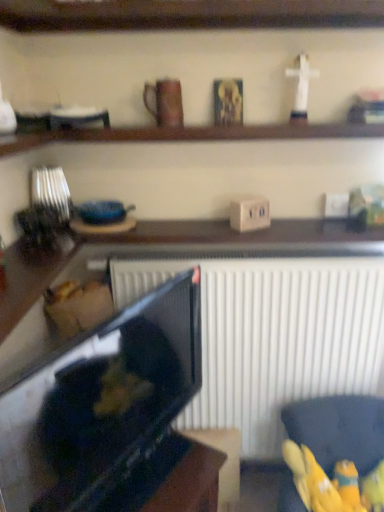
Question: Is wooden figurine at upper right, the 2th toy in the right-to-left sequence, inside brown matte mug at upper center?

Choices:
 (A) no
 (B) yes

Answer: (A)

Question: Would you say brown matte mug at upper center is a long distance from wooden figurine at upper right, the 2th toy in the right-to-left sequence?

Choices:
 (A) yes
 (B) no

Answer: (B)

Question: From a real-world perspective, is brown matte mug at upper center below wooden figurine at upper right, the 3th toy in the bottom-to-top sequence?

Choices:
 (A) yes
 (B) no

Answer: (B)

Question: From a real-world perspective, is brown matte mug at upper center positioned over wooden figurine at upper right, the 3th toy in the bottom-to-top sequence, based on gravity?

Choices:
 (A) yes
 (B) no

Answer: (A)

Question: Can we say brown matte mug at upper center lies outside wooden figurine at upper right, the second toy positioned from the top?

Choices:
 (A) yes
 (B) no

Answer: (A)

Question: In terms of size, does brown matte mug at upper center appear bigger or smaller than wooden shelf at upper center, marked as the 1th shelf in a bottom-to-top arrangement?

Choices:
 (A) small
 (B) big

Answer: (A)

Question: Is brown matte mug at upper center taller or shorter than wooden shelf at upper center, the 2th shelf when ordered from top to bottom?

Choices:
 (A) short
 (B) tall

Answer: (B)

Question: Is brown matte mug at upper center in front of or behind wooden shelf at upper center, marked as the 1th shelf in a bottom-to-top arrangement, in the image?

Choices:
 (A) behind
 (B) front

Answer: (A)

Question: From the image's perspective, is brown matte mug at upper center located above or below wooden shelf at upper center, marked as the 1th shelf in a bottom-to-top arrangement?

Choices:
 (A) below
 (B) above

Answer: (B)

Question: Considering the positions of point (148, 109) and point (365, 509), is point (148, 109) closer or farther from the camera than point (365, 509)?

Choices:
 (A) farther
 (B) closer

Answer: (B)

Question: Would you say brown matte mug at upper center is to the left or to the right of yellow fabric toy at lower right, the third toy viewed from the right, in the picture?

Choices:
 (A) left
 (B) right

Answer: (A)

Question: Considering the positions of brown matte mug at upper center and yellow fabric toy at lower right, the 1th toy in the bottom-to-top sequence, in the image, is brown matte mug at upper center taller or shorter than yellow fabric toy at lower right, the 1th toy in the bottom-to-top sequence,?

Choices:
 (A) tall
 (B) short

Answer: (A)

Question: Choose the correct answer: Is brown matte mug at upper center inside yellow fabric toy at lower right, the second toy in the left-to-right sequence, or outside it?

Choices:
 (A) inside
 (B) outside

Answer: (B)

Question: Considering the positions of wooden shelf at upper center, the 2th shelf when ordered from top to bottom, and white plastic cross at upper right, the first toy in the top-to-bottom sequence, in the image, is wooden shelf at upper center, the 2th shelf when ordered from top to bottom, wider or thinner than white plastic cross at upper right, the first toy in the top-to-bottom sequence,?

Choices:
 (A) wide
 (B) thin

Answer: (A)

Question: Do you think wooden shelf at upper center, marked as the 1th shelf in a bottom-to-top arrangement, is within white plastic cross at upper right, which is the 4th toy in bottom-to-top order, or outside of it?

Choices:
 (A) inside
 (B) outside

Answer: (B)